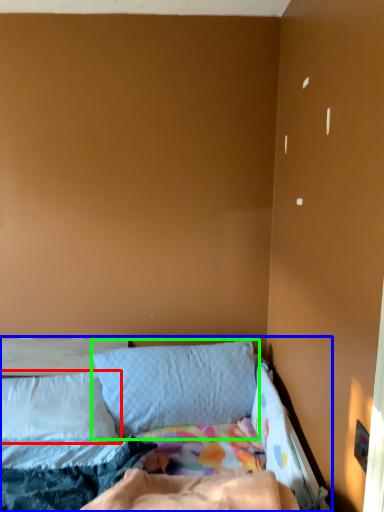
Question: Based on their relative distances, which object is farther from pillow (highlighted by a red box)? Choose from bed (highlighted by a blue box) and pillow (highlighted by a green box).

Choices:
 (A) bed
 (B) pillow

Answer: (B)